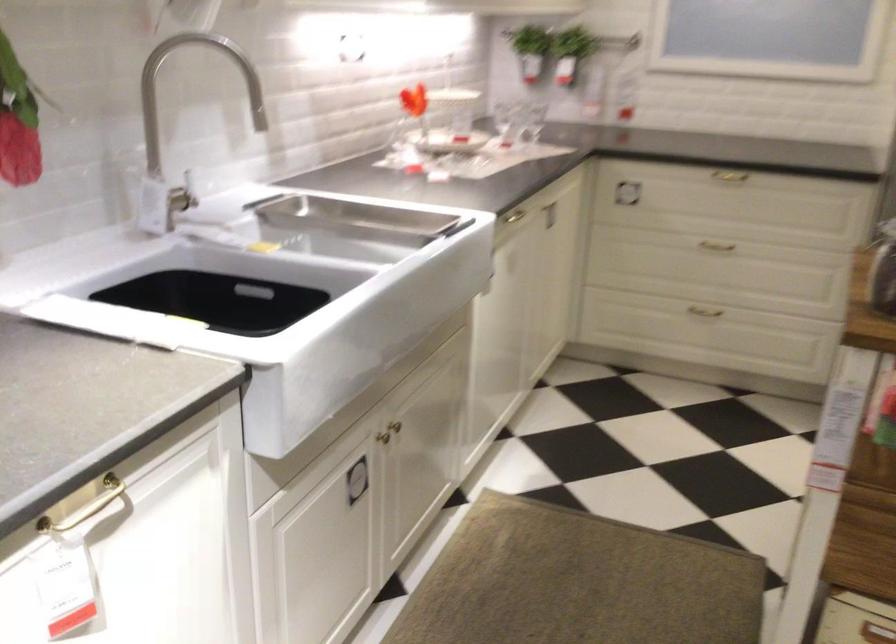
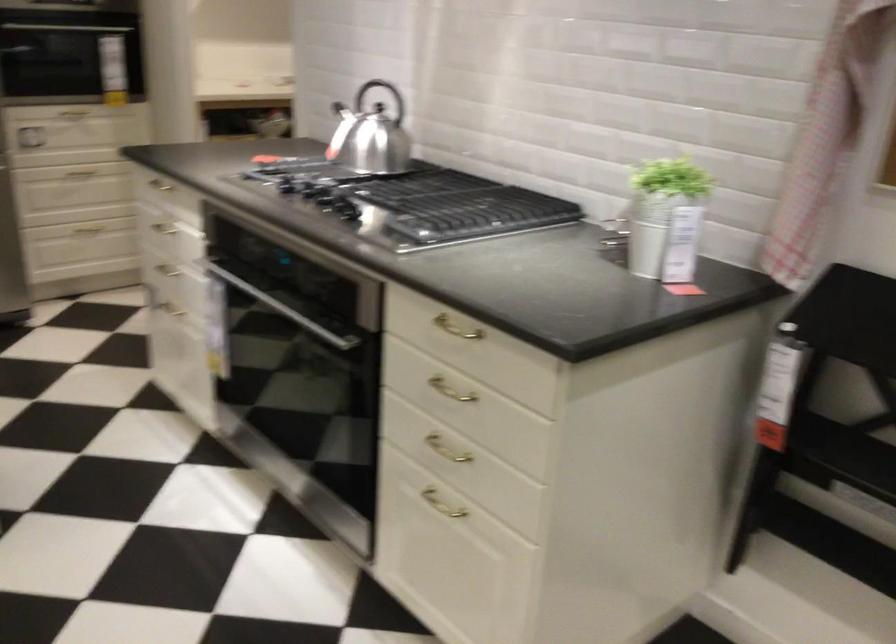
Question: The images are taken continuously from a first-person perspective. In which direction is your viewpoint rotating?

Choices:
 (A) Left
 (B) Right
 (C) Up
 (D) Down

Answer: (B)